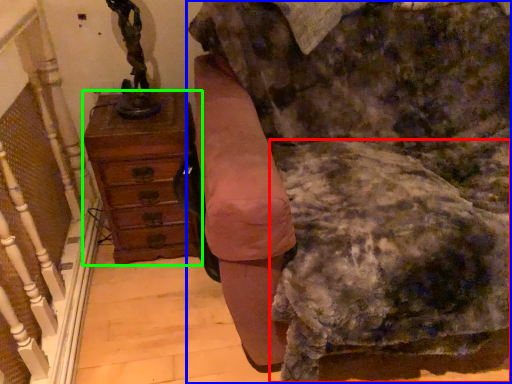
Question: Based on their relative distances, which object is farther from swivel chair (highlighted by a red box)? Choose from furniture (highlighted by a blue box) and chest of drawers (highlighted by a green box).

Choices:
 (A) furniture
 (B) chest of drawers

Answer: (B)